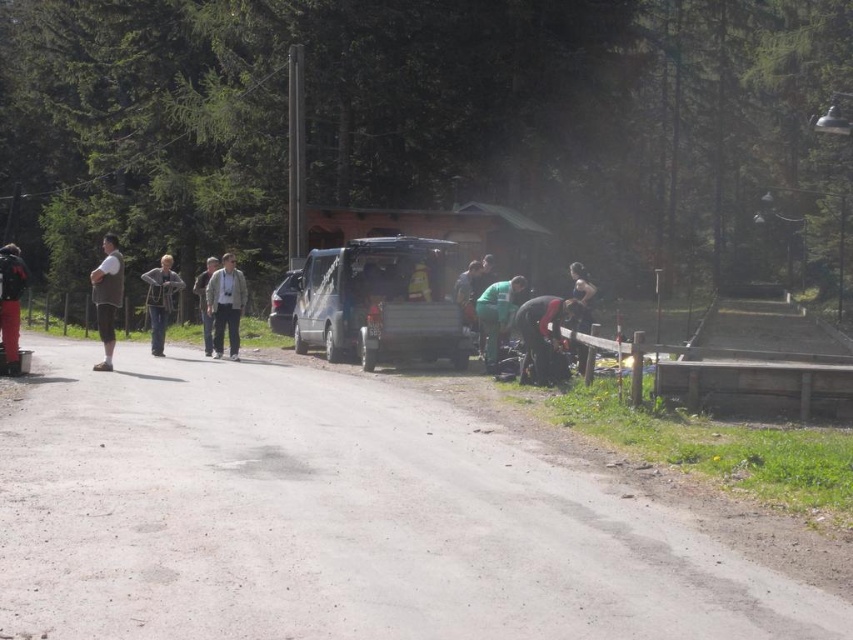
Find the location of a particular element. green fabric pants at lower center is located at coordinates (497, 316).

Is green fabric pants at lower center smaller than gray fabric jacket at center?

Indeed, green fabric pants at lower center has a smaller size compared to gray fabric jacket at center.

The image size is (853, 640). Identify the location of green fabric pants at lower center. (497, 316).

Between metallic silver van at center and dark gray fabric jacket at lower right, which one appears on the right side from the viewer's perspective?

dark gray fabric jacket at lower right

Which is below, metallic silver van at center or dark gray fabric jacket at lower right?

Positioned lower is dark gray fabric jacket at lower right.

I want to click on metallic silver van at center, so click(x=378, y=304).

Measure the distance from light brown leather jacket at center to brown cotton shorts at left.

The distance of light brown leather jacket at center from brown cotton shorts at left is 11.53 feet.

Does light brown leather jacket at center have a larger size compared to brown cotton shorts at left?

Actually, light brown leather jacket at center might be smaller than brown cotton shorts at left.

The width and height of the screenshot is (853, 640). What do you see at coordinates (225, 305) in the screenshot?
I see `light brown leather jacket at center` at bounding box center [225, 305].

Where is `light brown leather jacket at center`? Image resolution: width=853 pixels, height=640 pixels. light brown leather jacket at center is located at coordinates (225, 305).